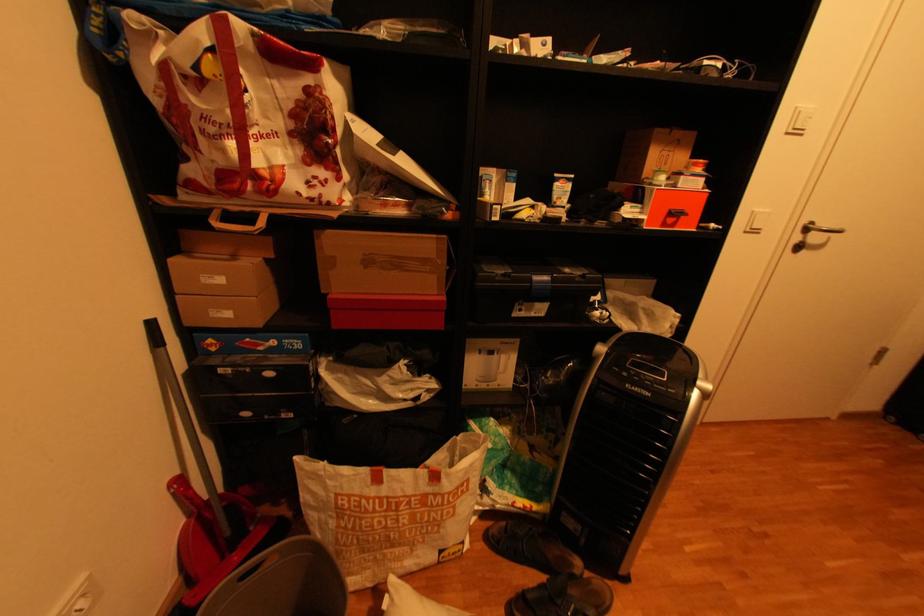
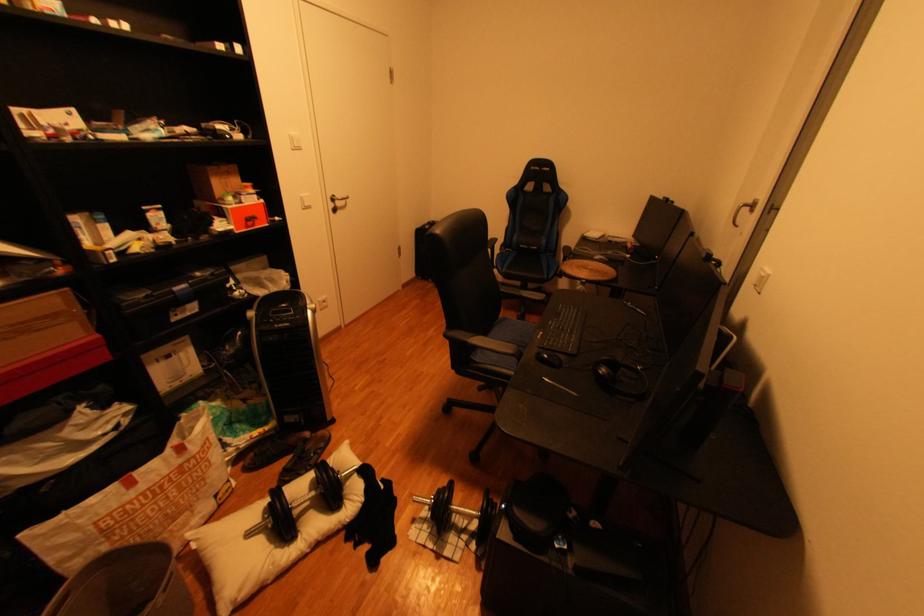
Find the pixel in the second image that matches pixel 821 223 in the first image.

(345, 197)